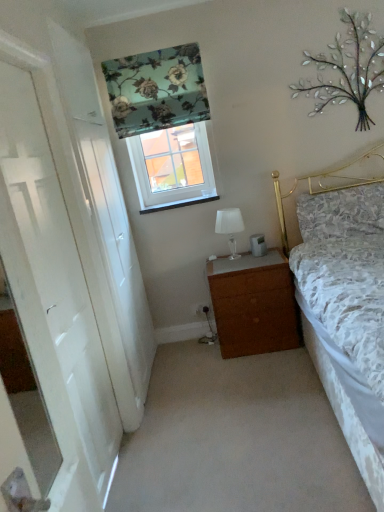
This screenshot has height=512, width=384. Find the location of `free space in front of white glossy door at left`. free space in front of white glossy door at left is located at coordinates (170, 401).